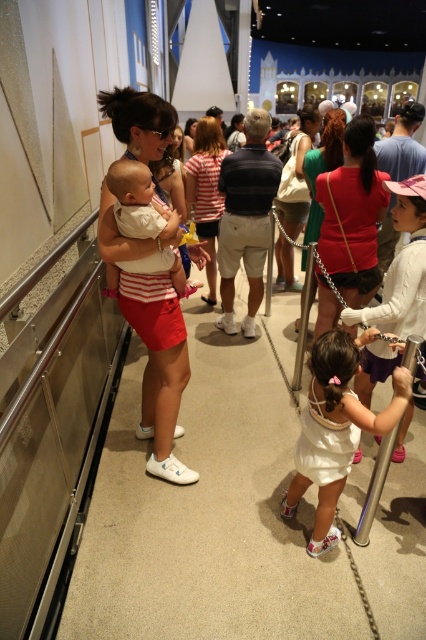
Does white fabric dress at center have a lesser width compared to white cotton baby at center?

Correct, white fabric dress at center's width is less than white cotton baby at center's.

Based on the photo, is white fabric dress at center shorter than white cotton baby at center?

Incorrect, white fabric dress at center's height does not fall short of white cotton baby at center's.

This screenshot has width=426, height=640. What do you see at coordinates (334, 429) in the screenshot? I see `white fabric dress at center` at bounding box center [334, 429].

At what (x,y) coordinates should I click in order to perform the action: click on white fabric dress at center. Please return your answer as a coordinate pair (x, y). Image resolution: width=426 pixels, height=640 pixels. Looking at the image, I should click on (334, 429).

Does white fabric dress at center have a larger size compared to matte red shirt at center?

No, white fabric dress at center is not bigger than matte red shirt at center.

Does white fabric dress at center appear on the left side of matte red shirt at center?

Indeed, white fabric dress at center is positioned on the left side of matte red shirt at center.

The height and width of the screenshot is (640, 426). What are the coordinates of `white fabric dress at center` in the screenshot? It's located at (334, 429).

This screenshot has width=426, height=640. What are the coordinates of `white fabric dress at center` in the screenshot? It's located at pyautogui.click(x=334, y=429).

Does matte white shorts at left have a greater height compared to matte red shirt at center?

Correct, matte white shorts at left is much taller as matte red shirt at center.

Does point (154, 452) lie in front of point (348, 230)?

That is True.

Find the location of a particular element. matte white shorts at left is located at coordinates (152, 326).